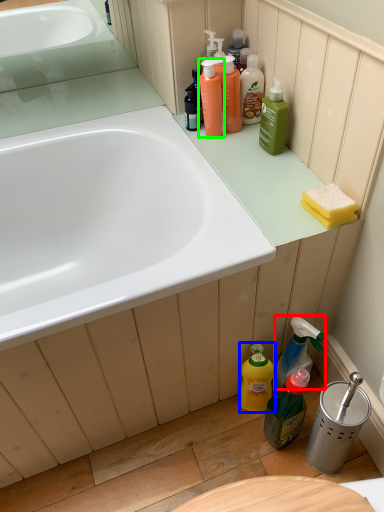
Question: Which is farther away from cleaning product (highlighted by a red box)? cleaning product (highlighted by a blue box) or cleaning product (highlighted by a green box)?

Choices:
 (A) cleaning product
 (B) cleaning product

Answer: (B)